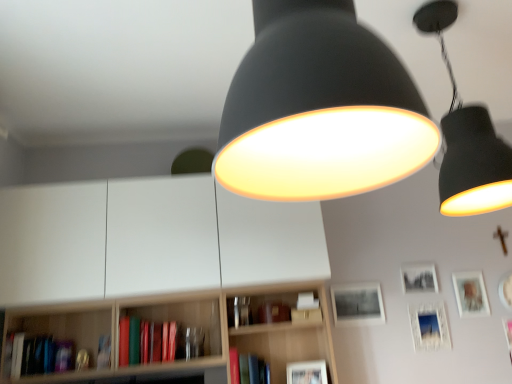
Image resolution: width=512 pixels, height=384 pixels. What do you see at coordinates (467, 139) in the screenshot? I see `matte black lampshade at upper right, the first lamp in the back-to-front sequence` at bounding box center [467, 139].

The image size is (512, 384). Describe the element at coordinates (106, 240) in the screenshot. I see `white matte bookcase at center` at that location.

Where is `matte white picture frame at lower right, which appears as the second picture frame when viewed from the right`? The width and height of the screenshot is (512, 384). matte white picture frame at lower right, which appears as the second picture frame when viewed from the right is located at coordinates (429, 326).

What is the approximate width of matte white picture frame at lower center, the first picture frame in the left-to-right sequence?

matte white picture frame at lower center, the first picture frame in the left-to-right sequence, is 4.18 inches wide.

The image size is (512, 384). I want to click on matte black lampshade at upper right, the first lamp when ordered from right to left, so [x=467, y=139].

From the image's perspective, is matte white picture frame at lower right, which appears as the second picture frame when viewed from the right, on top of hardcover book at lower left, which is the fourth book in right-to-left order?

Yes, from the image's perspective, matte white picture frame at lower right, which appears as the second picture frame when viewed from the right, is above hardcover book at lower left, which is the fourth book in right-to-left order.

How much distance is there between matte white picture frame at lower right, which appears as the second picture frame when viewed from the right, and hardcover book at lower left, which is the fourth book in right-to-left order?

matte white picture frame at lower right, which appears as the second picture frame when viewed from the right, and hardcover book at lower left, which is the fourth book in right-to-left order, are 2.17 meters apart.

Would you consider matte white picture frame at lower right, the 4th picture frame viewed from the left, to be distant from hardcover book at lower left, which is the fourth book in right-to-left order?

matte white picture frame at lower right, the 4th picture frame viewed from the left, is far away from hardcover book at lower left, which is the fourth book in right-to-left order.

From a real-world perspective, is matte white picture frame at lower right, which appears as the second picture frame when viewed from the right, physically located above or below hardcover book at lower left, which ranks as the 1th book in left-to-right order?

matte white picture frame at lower right, which appears as the second picture frame when viewed from the right, is situated lower than hardcover book at lower left, which ranks as the 1th book in left-to-right order, in the real world.

Considering the sizes of matte brown book at center, the 4th book viewed from the left, and matte red book at center, which is the 2th book in right-to-left order, in the image, is matte brown book at center, the 4th book viewed from the left, wider or thinner than matte red book at center, which is the 2th book in right-to-left order,?

In the image, matte brown book at center, the 4th book viewed from the left, appears to be more narrow than matte red book at center, which is the 2th book in right-to-left order.

Can you tell me how much matte brown book at center, the 4th book viewed from the left, and matte red book at center, which is the 2th book in right-to-left order, differ in facing direction?

They differ by 5.27 degrees in their facing directions.

From the matte brown book at center, the 4th book viewed from the left, count 2nd books forward and point to it. Please provide its 2D coordinates.

[(248, 369)]

Considering the sizes of objects matte white picture frame at lower right, the 4th picture frame viewed from the left, and black matte picture frame at upper right, placed as the third picture frame when sorted from right to left, in the image provided, who is smaller, matte white picture frame at lower right, the 4th picture frame viewed from the left, or black matte picture frame at upper right, placed as the third picture frame when sorted from right to left,?

black matte picture frame at upper right, placed as the third picture frame when sorted from right to left, is smaller.

Are matte white picture frame at lower right, the 4th picture frame viewed from the left, and black matte picture frame at upper right, the 3th picture frame in the left-to-right sequence, making contact?

No, matte white picture frame at lower right, the 4th picture frame viewed from the left, is not in contact with black matte picture frame at upper right, the 3th picture frame in the left-to-right sequence.

Can you tell me how much matte white picture frame at lower right, the 4th picture frame viewed from the left, and black matte picture frame at upper right, placed as the third picture frame when sorted from right to left, differ in facing direction?

The angular difference between matte white picture frame at lower right, the 4th picture frame viewed from the left, and black matte picture frame at upper right, placed as the third picture frame when sorted from right to left, is 0.807 degrees.

Is matte white picture frame at lower right, which appears as the second picture frame when viewed from the right, wider than black matte picture frame at upper right, the 3th picture frame in the left-to-right sequence?

Indeed, matte white picture frame at lower right, which appears as the second picture frame when viewed from the right, has a greater width compared to black matte picture frame at upper right, the 3th picture frame in the left-to-right sequence.

From a real-world perspective, between matte black lampshade at upper center, marked as the second lamp in a back-to-front arrangement, and black matte picture frame at upper right, placed as the third picture frame when sorted from right to left, who is vertically lower?

black matte picture frame at upper right, placed as the third picture frame when sorted from right to left, from a real-world perspective.

In terms of height, does matte black lampshade at upper center, which appears as the 2th lamp when viewed from the right, look taller or shorter compared to black matte picture frame at upper right, placed as the third picture frame when sorted from right to left?

matte black lampshade at upper center, which appears as the 2th lamp when viewed from the right, is taller than black matte picture frame at upper right, placed as the third picture frame when sorted from right to left.

Does matte black lampshade at upper center, which is the 1th lamp from front to back, turn towards black matte picture frame at upper right, placed as the third picture frame when sorted from right to left?

No.

Considering the positions of points (451, 69) and (370, 324), is point (451, 69) farther from camera compared to point (370, 324)?

No.

Is matte black lampshade at upper right, which is the second lamp from left to right, to the left of matte black picture frame at center, arranged as the fourth picture frame when viewed from the right, from the viewer's perspective?

In fact, matte black lampshade at upper right, which is the second lamp from left to right, is to the right of matte black picture frame at center, arranged as the fourth picture frame when viewed from the right.

From a real-world perspective, which object stands above the other?

matte black lampshade at upper right, the first lamp in the back-to-front sequence, is physically above.

Is matte black lampshade at upper right, the first lamp in the back-to-front sequence, next to matte black picture frame at center, which is the 2th picture frame in left-to-right order, and touching it?

No, matte black lampshade at upper right, the first lamp in the back-to-front sequence, is not with matte black picture frame at center, which is the 2th picture frame in left-to-right order.

Considering the relative positions of matte white picture frame at lower center, the first picture frame in the left-to-right sequence, and matte white picture frame at upper right, placed as the fifth picture frame when sorted from left to right, in the image provided, is matte white picture frame at lower center, the first picture frame in the left-to-right sequence, to the left of matte white picture frame at upper right, placed as the fifth picture frame when sorted from left to right, from the viewer's perspective?

Yes.

Can you confirm if matte white picture frame at lower center, the first picture frame in the left-to-right sequence, is taller than matte white picture frame at upper right, placed as the fifth picture frame when sorted from left to right?

No.

Does point (321, 383) appear closer or farther from the camera than point (477, 272)?

Point (321, 383) is closer to the camera than point (477, 272).

Which of these two, matte white picture frame at lower center, the first picture frame in the left-to-right sequence, or matte white picture frame at upper right, placed as the fifth picture frame when sorted from left to right, is smaller?

Smaller between the two is matte white picture frame at upper right, placed as the fifth picture frame when sorted from left to right.

Does hardcover book at lower left, which is the fourth book in right-to-left order, have a greater width compared to matte red book at center, the third book from the left?

No, hardcover book at lower left, which is the fourth book in right-to-left order, is not wider than matte red book at center, the third book from the left.

Measure the distance from hardcover book at lower left, which is the fourth book in right-to-left order, to matte red book at center, the third book from the left.

hardcover book at lower left, which is the fourth book in right-to-left order, and matte red book at center, the third book from the left, are 1.04 meters apart.

How many degrees apart are the facing directions of hardcover book at lower left, which ranks as the 1th book in left-to-right order, and matte red book at center, which is the 2th book in right-to-left order?

There is a 5.33-degree angle between the facing directions of hardcover book at lower left, which ranks as the 1th book in left-to-right order, and matte red book at center, which is the 2th book in right-to-left order.

Can matte red book at center, which is the 2th book in right-to-left order, be found inside hardcover book at lower left, which is the fourth book in right-to-left order?

Definitely not — matte red book at center, which is the 2th book in right-to-left order, is not inside hardcover book at lower left, which is the fourth book in right-to-left order.

Find the location of a particular element. Image resolution: width=512 pixels, height=384 pixels. picture frame that is the 2nd object located behind the hardcover book at lower left, which ranks as the 1th book in left-to-right order is located at coordinates pyautogui.click(x=429, y=326).

Where is `book that is the 2nd one when counting forward from the matte brown book at center, placed as the first book when sorted from right to left`? The image size is (512, 384). book that is the 2nd one when counting forward from the matte brown book at center, placed as the first book when sorted from right to left is located at coordinates (248, 369).

Looking at this image, from the image, which object appears to be nearer to matte red book at center, the third book from the left, matte black lampshade at upper center, which appears as the 2th lamp when viewed from the right, or hardcover book at lower left, the second book from the left?

hardcover book at lower left, the second book from the left.

Based on their spatial positions, is matte white picture frame at upper right, placed as the fifth picture frame when sorted from left to right, or white matte bookcase at center further from hardcover book at lower left, the second book from the left?

Result: Among the two, matte white picture frame at upper right, placed as the fifth picture frame when sorted from left to right, is located further to hardcover book at lower left, the second book from the left.

Considering their positions, is black matte picture frame at upper right, the 3th picture frame in the left-to-right sequence, positioned further to hardcover book at lower left, which ranks as the 1th book in left-to-right order, than matte red book at center, the third book from the left?

Among the two, black matte picture frame at upper right, the 3th picture frame in the left-to-right sequence, is located further to hardcover book at lower left, which ranks as the 1th book in left-to-right order.

From the image, which object appears to be farther from matte black lampshade at upper right, marked as the second lamp in a front-to-back arrangement, white matte bookcase at center or hardcover book at lower left, which is the fourth book in right-to-left order?

Based on the image, hardcover book at lower left, which is the fourth book in right-to-left order, appears to be further to matte black lampshade at upper right, marked as the second lamp in a front-to-back arrangement.

Based on their spatial positions, is matte brown book at center, placed as the first book when sorted from right to left, or matte white picture frame at lower right, which appears as the second picture frame when viewed from the right, further from hardcover book at lower left, marked as the third book in a right-to-left arrangement?

Among the two, matte white picture frame at lower right, which appears as the second picture frame when viewed from the right, is located further to hardcover book at lower left, marked as the third book in a right-to-left arrangement.

Based on their spatial positions, is black matte picture frame at upper right, the 3th picture frame in the left-to-right sequence, or matte black lampshade at upper right, the first lamp when ordered from right to left, closer to hardcover book at lower left, which ranks as the 1th book in left-to-right order?

black matte picture frame at upper right, the 3th picture frame in the left-to-right sequence, is positioned closer to the anchor hardcover book at lower left, which ranks as the 1th book in left-to-right order.

Looking at this image, which object lies further to the anchor point white matte bookcase at center, black matte picture frame at upper right, placed as the third picture frame when sorted from right to left, or matte white picture frame at lower right, the 4th picture frame viewed from the left?

Based on the image, black matte picture frame at upper right, placed as the third picture frame when sorted from right to left, appears to be further to white matte bookcase at center.

Considering their positions, is hardcover book at lower left, marked as the third book in a right-to-left arrangement, positioned closer to matte white picture frame at lower right, which appears as the second picture frame when viewed from the right, than matte white picture frame at upper right, which appears as the 1th picture frame when viewed from the right?

Based on the image, matte white picture frame at upper right, which appears as the 1th picture frame when viewed from the right, appears to be nearer to matte white picture frame at lower right, which appears as the second picture frame when viewed from the right.

I want to click on bookcase between hardcover book at lower left, which is the fourth book in right-to-left order, and matte black lampshade at upper right, the first lamp when ordered from right to left, in the horizontal direction, so click(x=106, y=240).

You are a GUI agent. You are given a task and a screenshot of the screen. Output one action in this format:
    pyautogui.click(x=<x>, y=<y>)
    Task: Click on the picture frame between white matte bookcase at center and matte black picture frame at center, which is the 2th picture frame in left-to-right order
    
    Given the screenshot: What is the action you would take?
    pyautogui.click(x=307, y=372)

I want to click on bookcase positioned between matte black lampshade at upper center, marked as the second lamp in a back-to-front arrangement, and hardcover book at lower left, marked as the third book in a right-to-left arrangement, from near to far, so click(x=106, y=240).

I want to click on bookcase situated between hardcover book at lower left, which is the fourth book in right-to-left order, and matte brown book at center, placed as the first book when sorted from right to left, from left to right, so click(x=106, y=240).